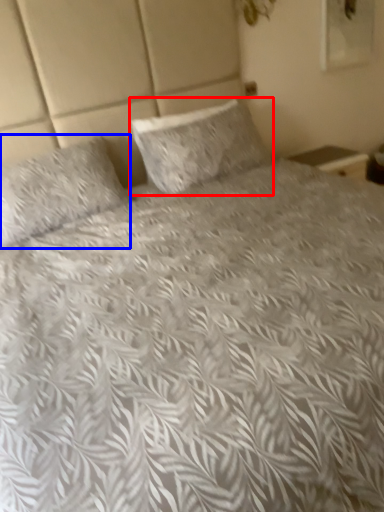
Question: Which object appears farthest to the camera in this image, pillow (highlighted by a red box) or pillow (highlighted by a blue box)?

Choices:
 (A) pillow
 (B) pillow

Answer: (A)